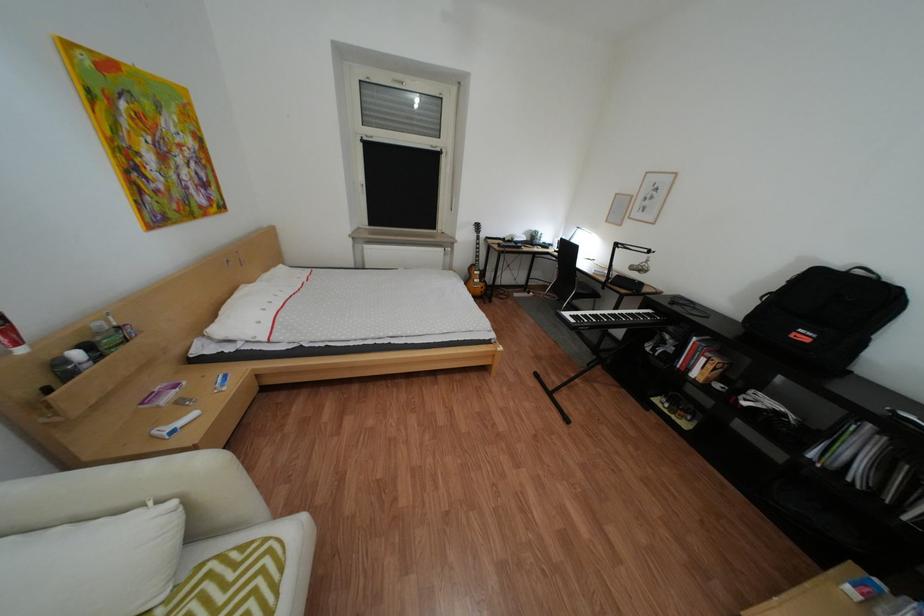
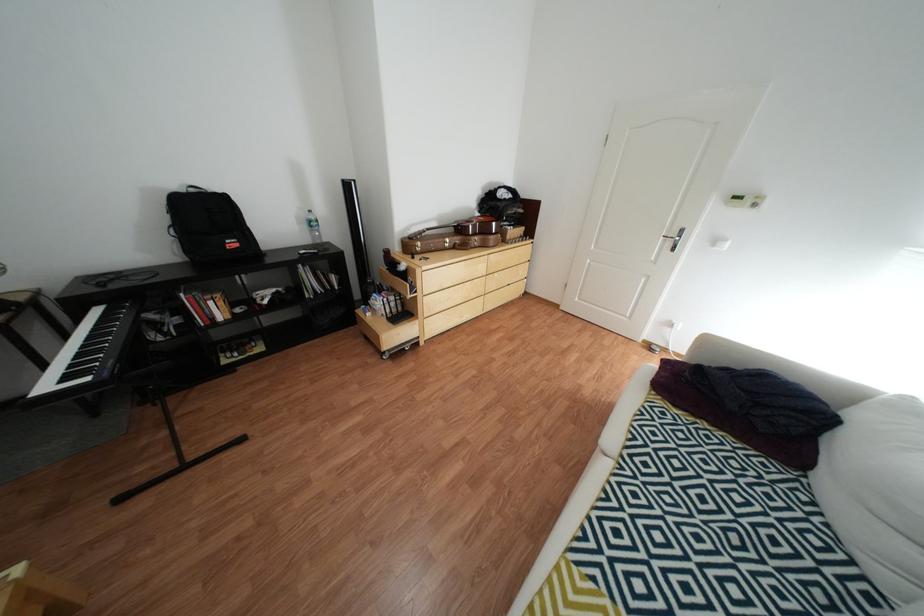
First-person continuous shooting, in which direction is the camera rotating?

The camera's rotation is toward right-down.